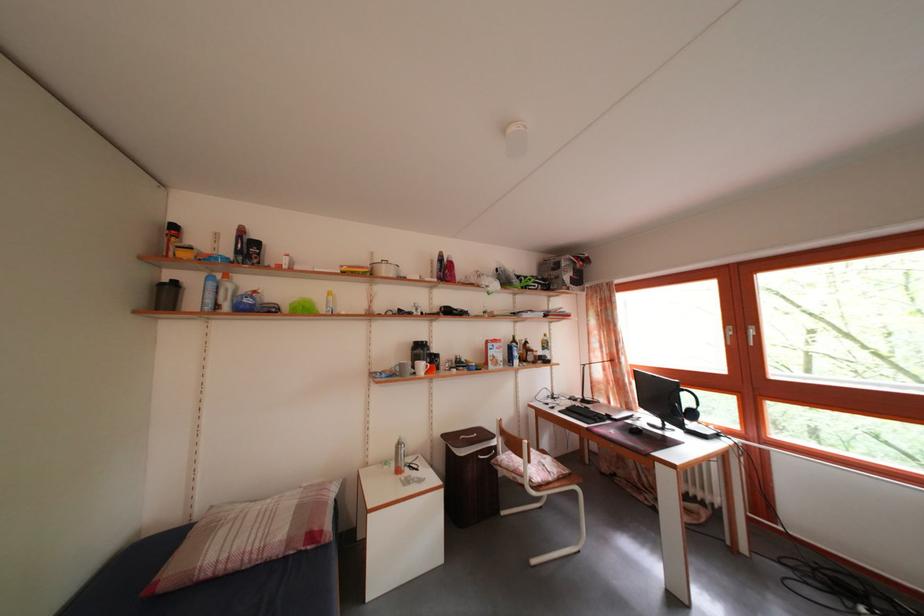
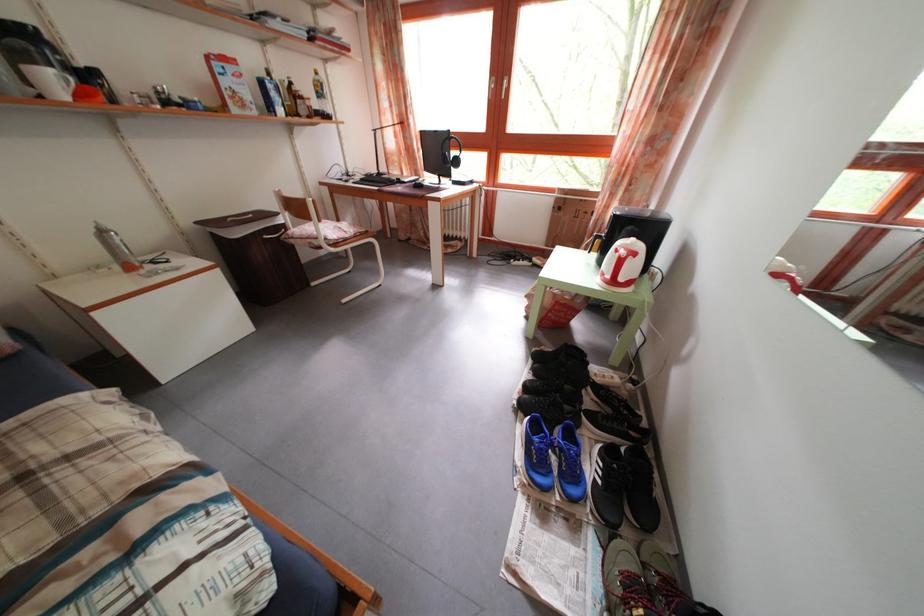
The point at [667,400] is marked in the first image. Where is the corresponding point in the second image?

(446, 160)